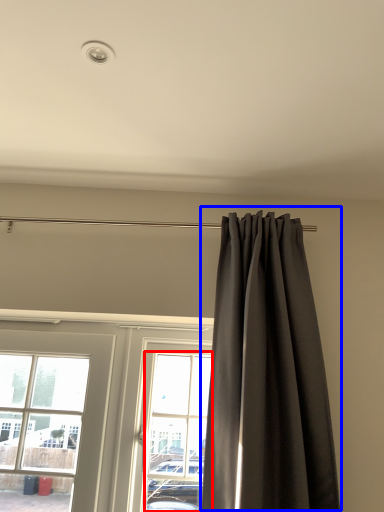
Question: Which object appears closest to the camera in this image, bay window (highlighted by a red box) or curtain (highlighted by a blue box)?

Choices:
 (A) bay window
 (B) curtain

Answer: (B)